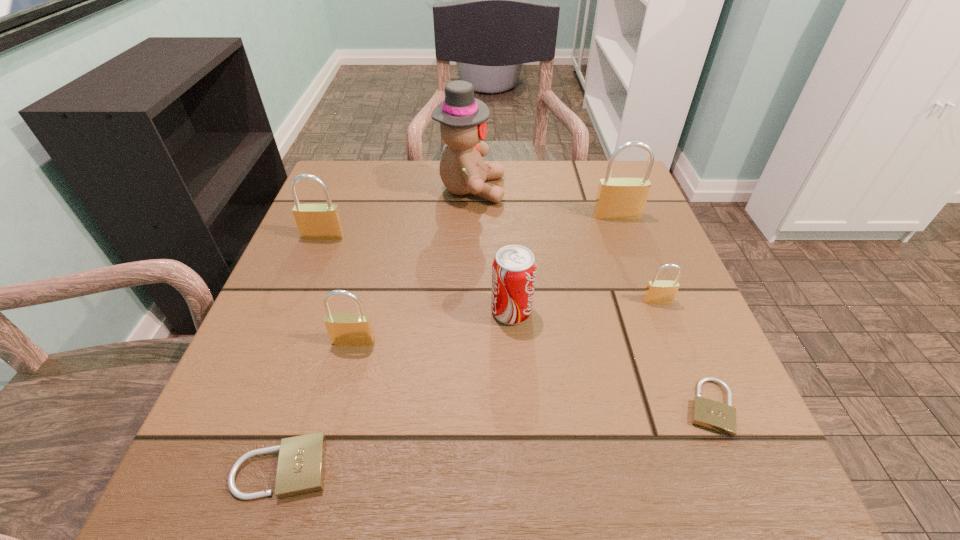
The width and height of the screenshot is (960, 540). In the image, there is a desktop. Identify the location of vacant space at the right edge. (687, 351).

Where is `vacant area at the far left corner`? This screenshot has height=540, width=960. vacant area at the far left corner is located at coordinates (361, 190).

Identify the location of vacant space at the near left corner of the desktop. (267, 470).

What are the coordinates of `free space at the far right corner of the desktop` in the screenshot? It's located at (582, 209).

This screenshot has height=540, width=960. In the image, there is a desktop. What are the coordinates of `free space at the near right corner` in the screenshot? It's located at (739, 479).

Image resolution: width=960 pixels, height=540 pixels. Identify the location of vacant area that lies between the third brass padlock from right to left and the rag_doll. (413, 265).

Where is `vacant point located between the sixth farthest object and the tallest object`? vacant point located between the sixth farthest object and the tallest object is located at coordinates (413, 265).

Where is `vacant space that's between the farthest padlock and the third nearest brass padlock`? vacant space that's between the farthest padlock and the third nearest brass padlock is located at coordinates (x=470, y=226).

This screenshot has width=960, height=540. I want to click on vacant area that lies between the fourth tallest padlock and the tallest padlock, so click(637, 258).

You are a GUI agent. You are given a task and a screenshot of the screen. Output one action in this format:
    pyautogui.click(x=<x>, y=<y>)
    Task: Click on the free space between the third nearest padlock and the tallest object
    
    Given the screenshot: What is the action you would take?
    pyautogui.click(x=413, y=265)